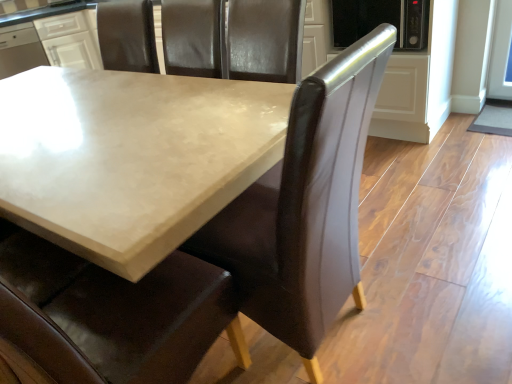
The image size is (512, 384). Identify the location of matte concrete table at center. (131, 157).

Identify the location of chair above the matte concrete table at center (from the image's perspective). This screenshot has width=512, height=384. (305, 207).

Is matte concrete table at center bigger than brown leather chair at center?

Incorrect, matte concrete table at center is not larger than brown leather chair at center.

From a real-world perspective, does matte concrete table at center sit lower than brown leather chair at center?

Actually, matte concrete table at center is physically above brown leather chair at center in the real world.

Between white glossy cabinet at upper left and brown leather chair at center, which one is positioned in front?

brown leather chair at center is in front.

Is brown leather chair at center at the back of white glossy cabinet at upper left?

No, brown leather chair at center is not at the back of white glossy cabinet at upper left.

There is a brown leather chair at center. Find the location of `cabinetry above it (from a real-world perspective)`. cabinetry above it (from a real-world perspective) is located at coordinates (69, 41).

Between white glossy cabinet at upper left and brown leather chair at center, which one has less height?

white glossy cabinet at upper left.

Can you confirm if white glossy cabinet at upper left is smaller than matte concrete table at center?

Indeed, white glossy cabinet at upper left has a smaller size compared to matte concrete table at center.

Looking at this image, who is shorter, white glossy cabinet at upper left or matte concrete table at center?

white glossy cabinet at upper left is shorter.

Does point (80, 50) lie behind point (24, 193)?

Yes, point (80, 50) is farther from viewer.

From a real-world perspective, is white glossy cabinet at upper left located beneath matte concrete table at center?

No, from a real-world perspective, white glossy cabinet at upper left is not below matte concrete table at center.

Is brown leather chair at center to the left of matte concrete table at center from the viewer's perspective?

No.

Would you say brown leather chair at center contains matte concrete table at center?

No.

How far apart are brown leather chair at center and matte concrete table at center?

18.20 inches.

From a real-world perspective, who is located lower, brown leather chair at center or matte concrete table at center?

brown leather chair at center is physically lower.

From a real-world perspective, which object stands above the other?

white glossy cabinet at upper left.

Is matte concrete table at center in front of or behind white glossy cabinet at upper left in the image?

Clearly, matte concrete table at center is in front of white glossy cabinet at upper left.

Considering the relative sizes of matte concrete table at center and white glossy cabinet at upper left in the image provided, is matte concrete table at center bigger than white glossy cabinet at upper left?

Correct, matte concrete table at center is larger in size than white glossy cabinet at upper left.

Based on the photo, considering the relative positions of matte concrete table at center and white glossy cabinet at upper left in the image provided, is matte concrete table at center to the right of white glossy cabinet at upper left from the viewer's perspective?

Yes, matte concrete table at center is to the right of white glossy cabinet at upper left.

How many degrees apart are the facing directions of brown leather chair at center and white glossy cabinet at upper left?

The angular difference between brown leather chair at center and white glossy cabinet at upper left is 145 degrees.

From a real-world perspective, is brown leather chair at center positioned above or below white glossy cabinet at upper left?

From a real-world perspective, brown leather chair at center is physically below white glossy cabinet at upper left.

From the picture: Is brown leather chair at center positioned with its back to white glossy cabinet at upper left?

No, brown leather chair at center is not facing away from white glossy cabinet at upper left.

From the image's perspective, between brown leather chair at center and white glossy cabinet at upper left, who is located below?

brown leather chair at center appears lower in the image.

You are a GUI agent. You are given a task and a screenshot of the screen. Output one action in this format:
    pyautogui.click(x=<x>, y=<y>)
    Task: Click on the chair below the matte concrete table at center (from a real-world perspective)
    This screenshot has width=512, height=384.
    Given the screenshot: What is the action you would take?
    pyautogui.click(x=305, y=207)

The image size is (512, 384). In order to click on chair in front of the white glossy cabinet at upper left in this screenshot , I will do `click(305, 207)`.

Looking at the image, which one is located further to matte concrete table at center, white glossy cabinet at upper left or brown leather chair at center?

white glossy cabinet at upper left.

From the image, which object appears to be farther from brown leather chair at center, matte concrete table at center or white glossy cabinet at upper left?

white glossy cabinet at upper left is positioned further to the anchor brown leather chair at center.

When comparing their distances from brown leather chair at center, does white glossy cabinet at upper left or matte concrete table at center seem closer?

matte concrete table at center.

Based on the photo, estimate the real-world distances between objects in this image. Which object is closer to white glossy cabinet at upper left, brown leather chair at center or matte concrete table at center?

The object closer to white glossy cabinet at upper left is matte concrete table at center.

When comparing their distances from white glossy cabinet at upper left, does matte concrete table at center or brown leather chair at center seem further?

The object further to white glossy cabinet at upper left is brown leather chair at center.

Estimate the real-world distances between objects in this image. Which object is further from matte concrete table at center, brown leather chair at center or white glossy cabinet at upper left?

white glossy cabinet at upper left is further to matte concrete table at center.

Image resolution: width=512 pixels, height=384 pixels. I want to click on chair between matte concrete table at center and white glossy cabinet at upper left from front to back, so click(x=305, y=207).